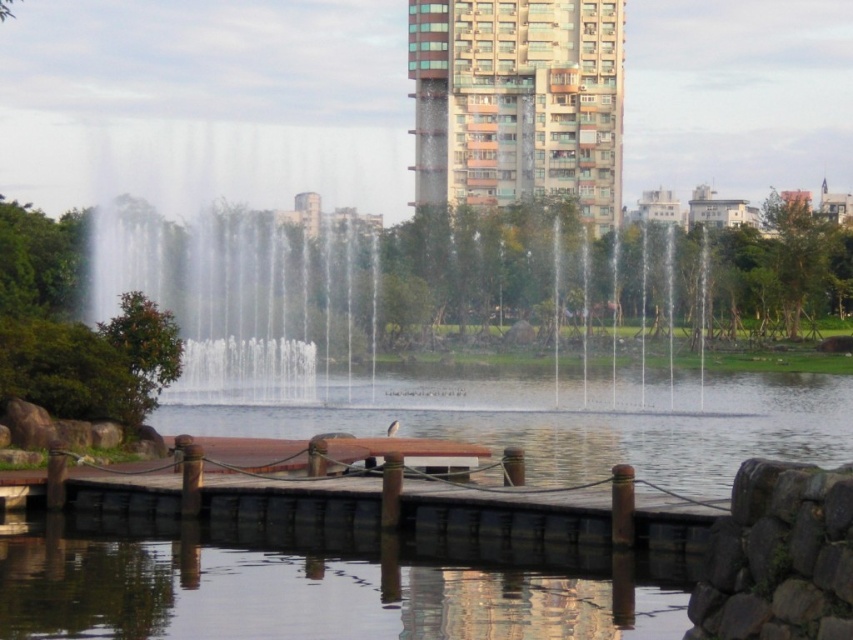
You are standing at the entrance of the dock and want to locate the transparent water at dock center. According to the coordinates provided, in which direction should you look relative to your current position?

The transparent water at dock center is located at coordinates point (544, 419). Since you are at the entrance of the dock, which is likely at the lower end, looking towards the center of the dock would mean looking forward or ahead. The coordinates suggest it is positioned to the right and slightly above your current viewpoint, so you should look forward and to the right to find it.

You are standing at the entrance of the park and want to reach the transparent glass pond at center. According to the coordinates provided, in which direction should you walk from your current position to reach it?

The transparent glass pond at center is located at coordinates point (297, 593). Since you are at the entrance, you should walk towards the center of the park to reach it.

You are a photographer planning to capture the entire scene of the transparent water at dock center and the brown glassy building at upper center in a single shot. Based on their sizes in the image, which object should you focus on first to ensure both are clearly visible?

The transparent water at dock center occupies less space than the brown glassy building at upper center, so you should focus on the brown glassy building at upper center first since it is larger and will require more attention to capture details clearly while ensuring the smaller transparent water at dock center remains in focus.